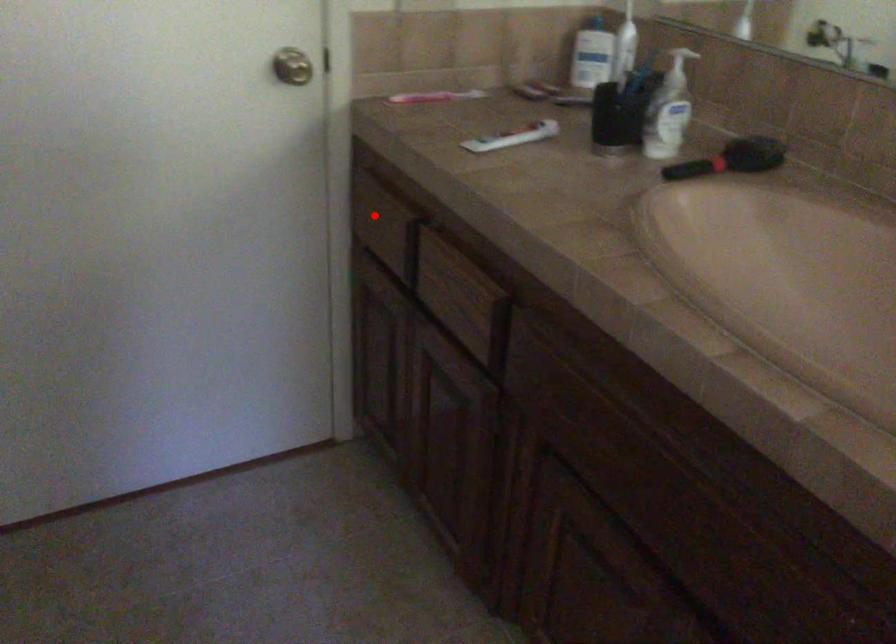
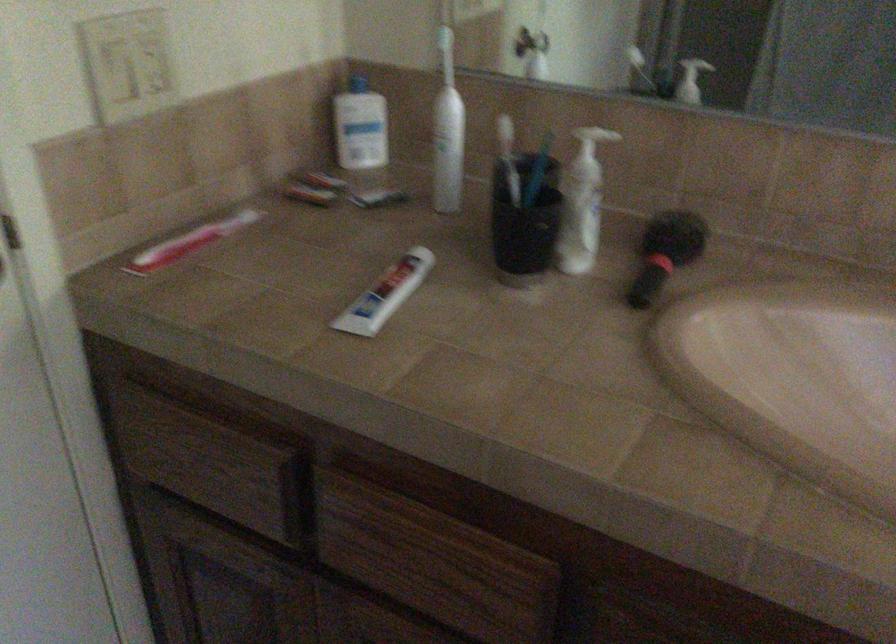
Question: I am providing you with two images of the same scene from different viewpoints. In image1, a red point is highlighted. Considering the same 3D point in image2, which of the following is correct?

Choices:
 (A) It is closer
 (B) It is farther

Answer: (A)